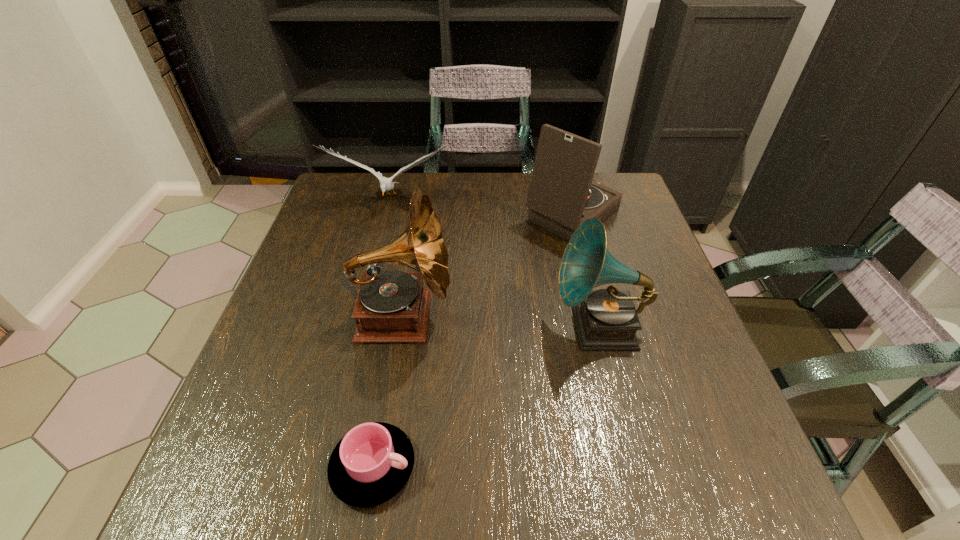
Image resolution: width=960 pixels, height=540 pixels. In order to click on vacant area that lies between the leftmost phonograph_record and the farthest phonograph_record in this screenshot , I will do `click(487, 266)`.

Identify the location of vacant space that's between the farthest phonograph_record and the second shortest object. (482, 208).

The height and width of the screenshot is (540, 960). Identify the location of vacant region between the gull and the farthest phonograph_record. (482, 208).

Where is `object that can be found as the fourth closest to the gull`? object that can be found as the fourth closest to the gull is located at coordinates (371, 464).

Where is `object that can be found as the second closest to the leftmost phonograph_record`? This screenshot has width=960, height=540. object that can be found as the second closest to the leftmost phonograph_record is located at coordinates pyautogui.click(x=607, y=319).

Select which phonograph_record is the closest to the leftmost phonograph_record. Please provide its 2D coordinates. Your answer should be formatted as a tuple, i.e. [(x, y)], where the tuple contains the x and y coordinates of a point satisfying the conditions above.

[(607, 319)]

Identify which phonograph_record is the third nearest to the fourth tallest object. Please provide its 2D coordinates. Your answer should be formatted as a tuple, i.e. [(x, y)], where the tuple contains the x and y coordinates of a point satisfying the conditions above.

[(607, 319)]

The width and height of the screenshot is (960, 540). I want to click on free space that satisfies the following two spatial constraints: 1. at the tip of the beak of the second shortest object; 2. on the right side of the farthest phonograph_record, so click(x=388, y=214).